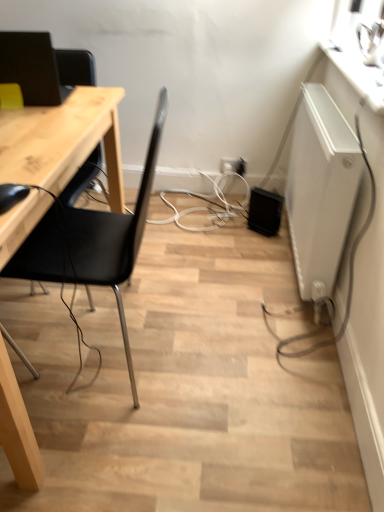
Identify the location of free space to the right of black matte chair at left. Image resolution: width=384 pixels, height=512 pixels. (237, 337).